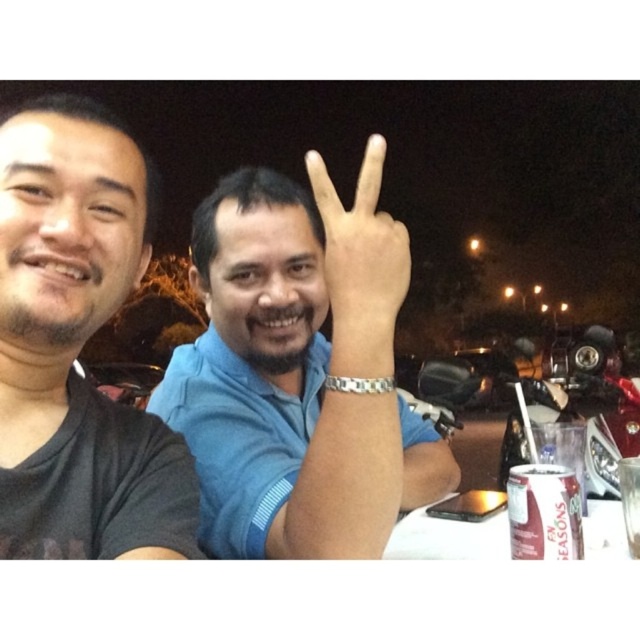
Question: Which of the following is the farthest from the observer?

Choices:
 (A) silver metallic hand at center
 (B) blue cotton shirt at center
 (C) metallic silver motorcycle at right

Answer: (C)

Question: Which object is farther from the camera taking this photo?

Choices:
 (A) white paper table at lower right
 (B) black matte shirt at left
 (C) metallic silver motorcycle at right
 (D) blue cotton shirt at center

Answer: (C)

Question: Based on their relative distances, which object is nearer to the white paper table at lower right?

Choices:
 (A) silver metallic hand at center
 (B) blue cotton shirt at center
 (C) metallic silver motorcycle at right

Answer: (B)

Question: Can you confirm if blue cotton shirt at center is bigger than metallic silver motorcycle at right?

Choices:
 (A) no
 (B) yes

Answer: (A)

Question: Is the position of black matte shirt at left more distant than that of white paper table at lower right?

Choices:
 (A) yes
 (B) no

Answer: (B)

Question: Is silver metallic hand at center thinner than white paper table at lower right?

Choices:
 (A) yes
 (B) no

Answer: (A)